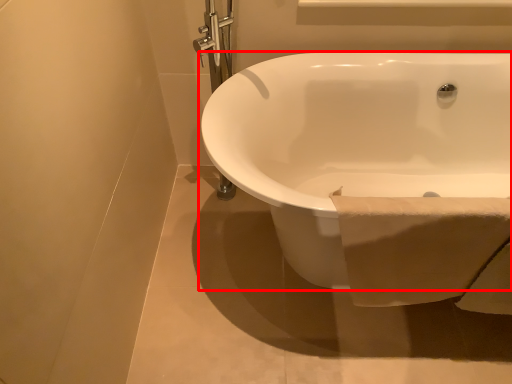
Question: From the image's perspective, what is the correct spatial relationship of bathtub (annotated by the red box) in relation to toilet paper?

Choices:
 (A) below
 (B) above

Answer: (B)